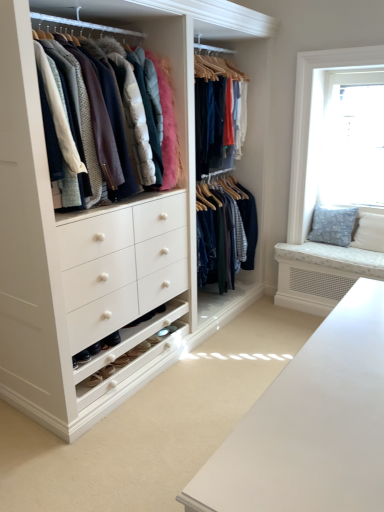
Question: Is transparent glass window at upper right inside matte white coat rack at upper left?

Choices:
 (A) no
 (B) yes

Answer: (A)

Question: Is matte white coat rack at upper left not within transparent glass window at upper right?

Choices:
 (A) no
 (B) yes

Answer: (B)

Question: Does matte white coat rack at upper left have a lesser height compared to transparent glass window at upper right?

Choices:
 (A) no
 (B) yes

Answer: (B)

Question: From a real-world perspective, is matte white coat rack at upper left positioned under transparent glass window at upper right based on gravity?

Choices:
 (A) yes
 (B) no

Answer: (B)

Question: From the image's perspective, is matte white coat rack at upper left located above transparent glass window at upper right?

Choices:
 (A) no
 (B) yes

Answer: (A)

Question: Does matte white coat rack at upper left have a greater width compared to transparent glass window at upper right?

Choices:
 (A) yes
 (B) no

Answer: (A)

Question: From a real-world perspective, is matte white coat rack at upper left beneath blue textured cushion at right?

Choices:
 (A) no
 (B) yes

Answer: (A)

Question: Is matte white coat rack at upper left to the right of blue textured cushion at right from the viewer's perspective?

Choices:
 (A) yes
 (B) no

Answer: (B)

Question: Is matte white coat rack at upper left thinner than blue textured cushion at right?

Choices:
 (A) no
 (B) yes

Answer: (A)

Question: From the image's perspective, is matte white coat rack at upper left beneath blue textured cushion at right?

Choices:
 (A) no
 (B) yes

Answer: (A)

Question: From a real-world perspective, is matte white coat rack at upper left positioned over blue textured cushion at right based on gravity?

Choices:
 (A) yes
 (B) no

Answer: (A)

Question: Is matte white coat rack at upper left turned away from blue textured cushion at right?

Choices:
 (A) yes
 (B) no

Answer: (B)

Question: Does blue textured cushion at right have a lesser height compared to transparent glass window at upper right?

Choices:
 (A) no
 (B) yes

Answer: (B)